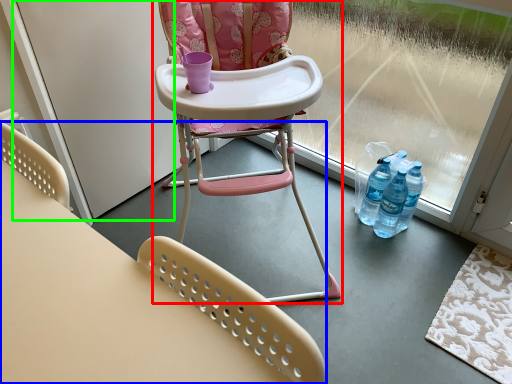
Question: Considering the real-world distances, which object is farthest from chair (highlighted by a red box)? chair (highlighted by a blue box) or screen door (highlighted by a green box)?

Choices:
 (A) chair
 (B) screen door

Answer: (A)